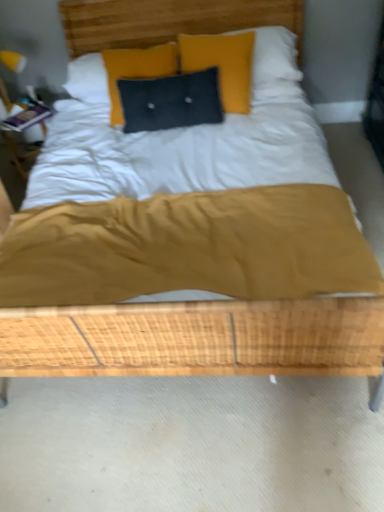
This screenshot has height=512, width=384. Describe the element at coordinates (22, 132) in the screenshot. I see `wooden table at left` at that location.

The width and height of the screenshot is (384, 512). Identify the location of wooden table at left. (22, 132).

This screenshot has height=512, width=384. What are the coordinates of `wooden table at left` in the screenshot? It's located at (22, 132).